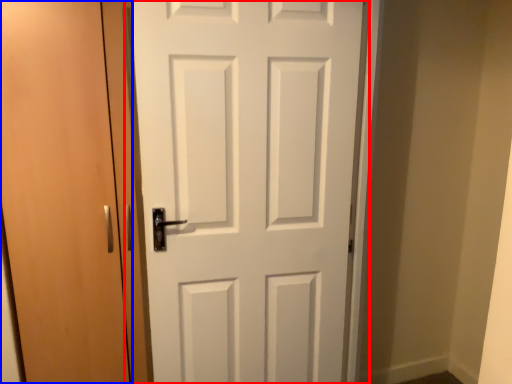
Question: Which object appears farthest to the camera in this image, door (highlighted by a red box) or door (highlighted by a blue box)?

Choices:
 (A) door
 (B) door

Answer: (B)